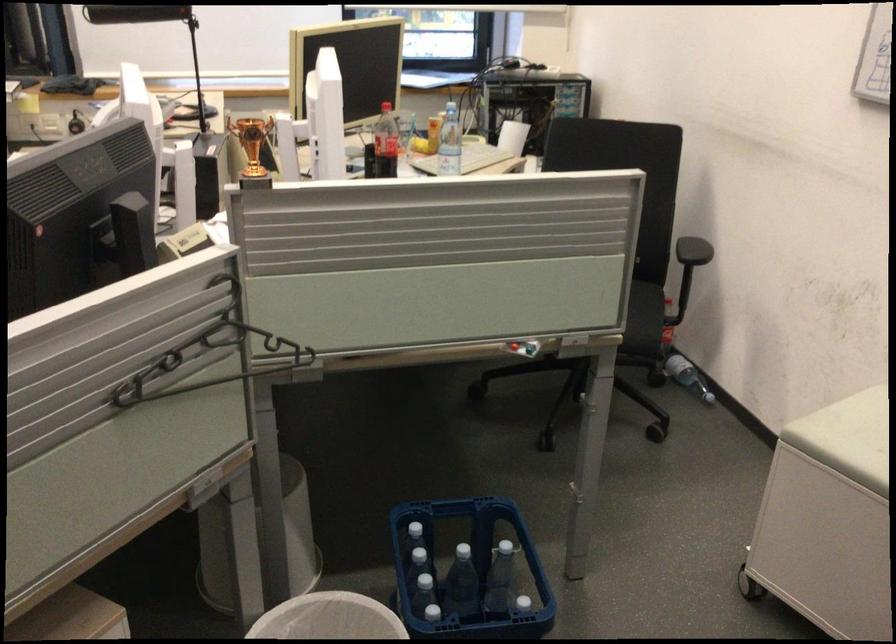
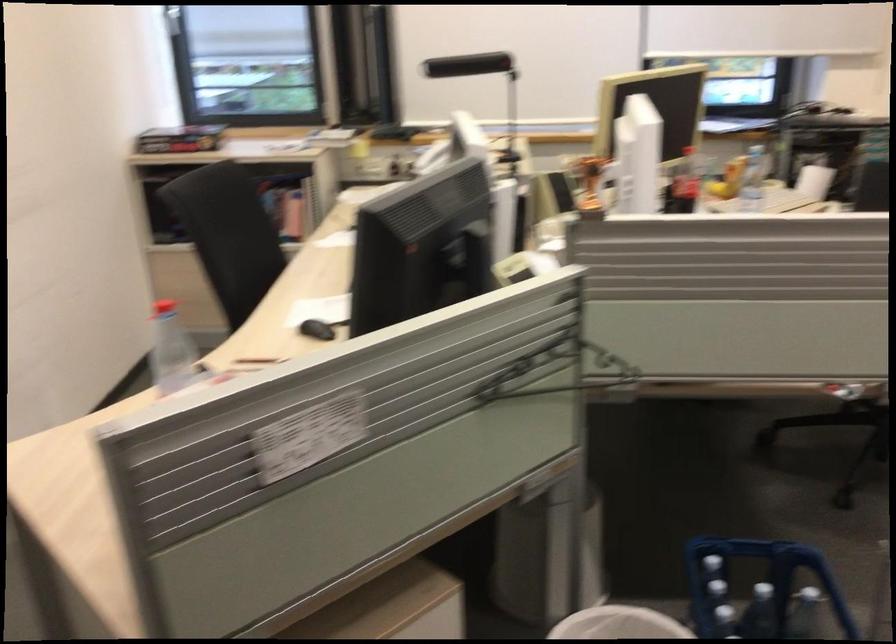
Question: The images are taken continuously from a first-person perspective. In which direction is your viewpoint rotating?

Choices:
 (A) Left
 (B) Right
 (C) Up
 (D) Down

Answer: (A)